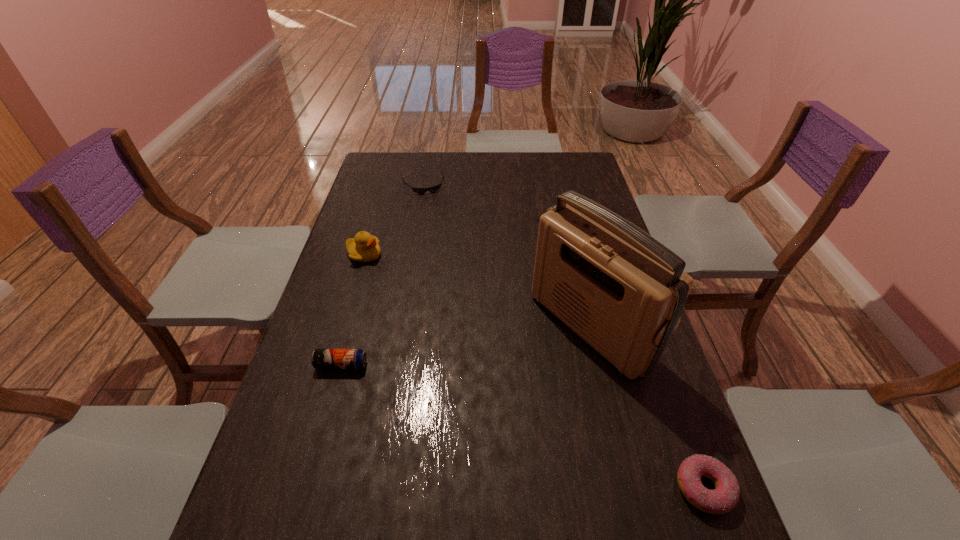
You are a GUI agent. You are given a task and a screenshot of the screen. Output one action in this format:
    pyautogui.click(x=<x>, y=<y>)
    Task: Click on the free space at the right edge of the desktop
    This screenshot has width=960, height=540.
    Given the screenshot: What is the action you would take?
    pyautogui.click(x=628, y=474)

In order to click on vacant position at the far left corner of the desktop in this screenshot , I will do `click(399, 159)`.

Locate an element on the screen. vacant region at the far right corner is located at coordinates (574, 174).

The width and height of the screenshot is (960, 540). Find the location of `free spot at the near right corner of the desktop`. free spot at the near right corner of the desktop is located at coordinates (705, 518).

This screenshot has width=960, height=540. Find the location of `vacant area that lies between the nearest object and the second farthest object`. vacant area that lies between the nearest object and the second farthest object is located at coordinates (534, 372).

This screenshot has width=960, height=540. Identify the location of unoccupied position between the beer can and the farthest object. (382, 275).

The height and width of the screenshot is (540, 960). Find the location of `free space between the doughnut and the sunglasses`. free space between the doughnut and the sunglasses is located at coordinates pyautogui.click(x=564, y=336).

This screenshot has height=540, width=960. Find the location of `unoccupied position between the tallest object and the duckling`. unoccupied position between the tallest object and the duckling is located at coordinates (477, 291).

Where is `free space between the radio receiver and the doughnut`? free space between the radio receiver and the doughnut is located at coordinates (647, 408).

Where is `empty location between the beer can and the sunglasses`? empty location between the beer can and the sunglasses is located at coordinates (382, 275).